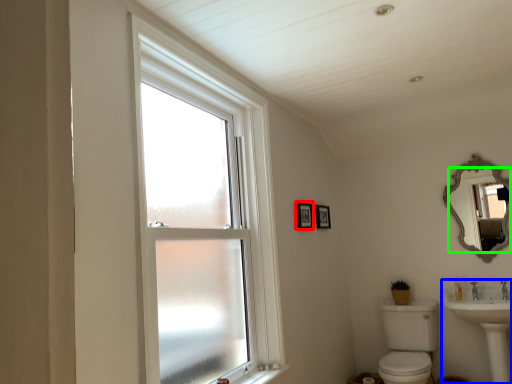
Question: Based on their relative distances, which object is farther from picture frame (highlighted by a red box)? Choose from sink (highlighted by a blue box) and mirror (highlighted by a green box).

Choices:
 (A) sink
 (B) mirror

Answer: (A)